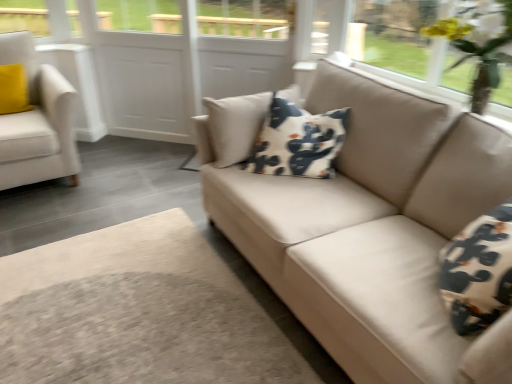
Question: Choose the correct answer: Is beige fabric couch at center inside white fabric armchair at left or outside it?

Choices:
 (A) outside
 (B) inside

Answer: (A)

Question: From the image's perspective, is beige fabric couch at center above or below white fabric armchair at left?

Choices:
 (A) above
 (B) below

Answer: (B)

Question: Which of these objects is positioned farthest from the yellow artificial flowers at upper right?

Choices:
 (A) white fabric armchair at left
 (B) white cotton pillow at center
 (C) white matte screen door at center
 (D) beige fabric couch at center

Answer: (A)

Question: Which object is the farthest from the beige fabric couch at center?

Choices:
 (A) yellow artificial flowers at upper right
 (B) white cotton pillow at center
 (C) white fabric armchair at left
 (D) white matte screen door at center

Answer: (D)